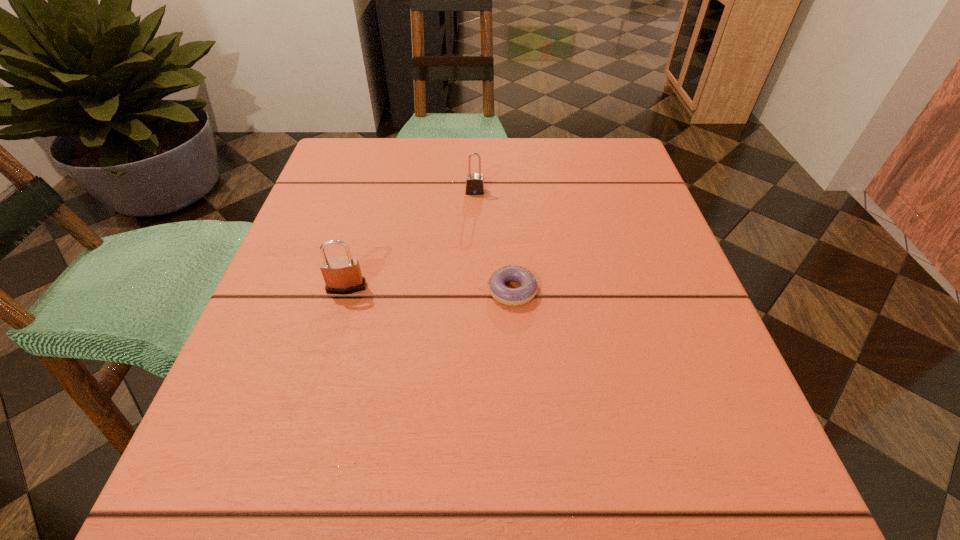
Identify the location of the nearer padlock. The height and width of the screenshot is (540, 960). (342, 275).

I want to click on the left padlock, so click(342, 275).

This screenshot has height=540, width=960. What are the coordinates of `the farthest object` in the screenshot? It's located at (474, 185).

What are the coordinates of `the farther padlock` in the screenshot? It's located at (474, 185).

Image resolution: width=960 pixels, height=540 pixels. What are the coordinates of `the shortest object` in the screenshot? It's located at (509, 296).

The width and height of the screenshot is (960, 540). Identify the location of doughnut. (509, 296).

The height and width of the screenshot is (540, 960). Find the location of `vacant space located on the right of the left padlock`. vacant space located on the right of the left padlock is located at coordinates (544, 288).

Identify the location of free region located 0.380m on the shackle of the right padlock. (472, 344).

Image resolution: width=960 pixels, height=540 pixels. What are the coordinates of `free space located 0.160m on the left of the shortest object` in the screenshot? It's located at (392, 291).

Identify the location of object at the far edge. The height and width of the screenshot is (540, 960). (474, 185).